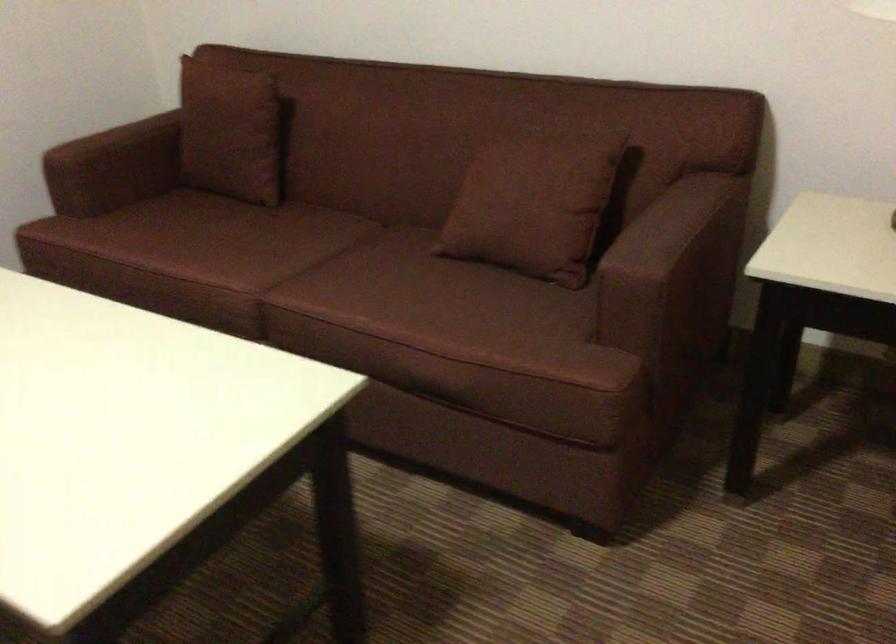
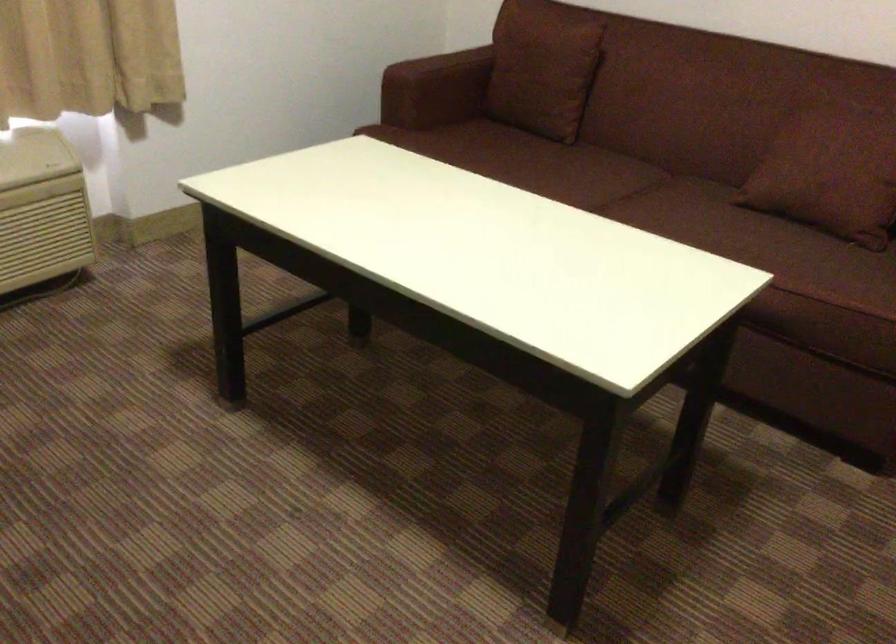
The point at (115,140) is marked in the first image. Where is the corresponding point in the second image?

(441, 66)